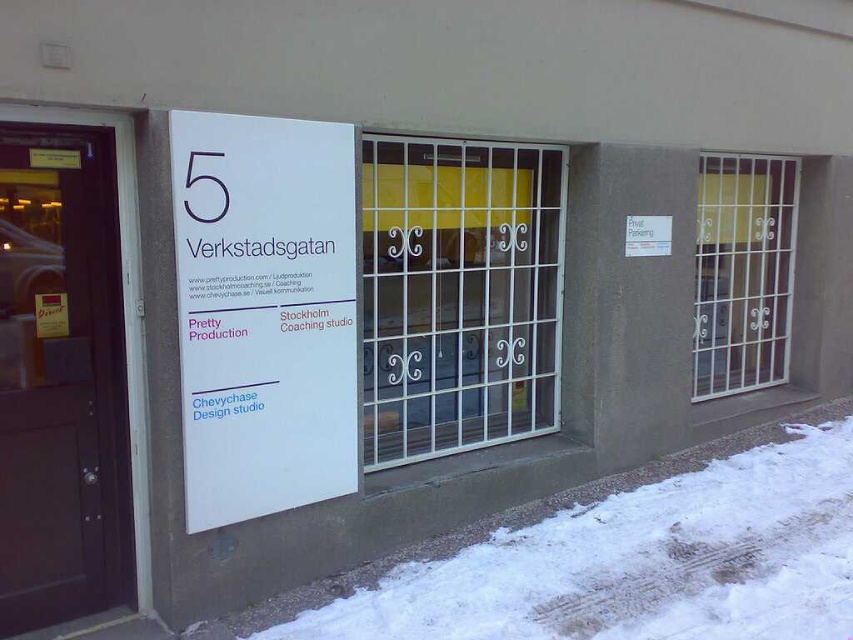
Which is below, white paper sign at center or brown wooden door at left?

Positioned lower is brown wooden door at left.

Between white paper sign at center and brown wooden door at left, which one has less height?

white paper sign at center

Locate an element on the screen. This screenshot has height=640, width=853. white paper sign at center is located at coordinates (264, 312).

Which of these two, white powdery snow at lower right or white metal gate at center, stands taller?

white metal gate at center

Who is higher up, white powdery snow at lower right or white metal gate at center?

Positioned higher is white metal gate at center.

Does point (782, 520) come in front of point (424, 298)?

Yes, it is.

At what (x,y) coordinates should I click in order to perform the action: click on white powdery snow at lower right. Please return your answer as a coordinate pair (x, y). Image resolution: width=853 pixels, height=640 pixels. Looking at the image, I should click on (641, 563).

Consider the image. Which is more to the left, white powdery snow at lower right or brown wooden door at left?

brown wooden door at left

Does white powdery snow at lower right have a lesser width compared to brown wooden door at left?

No.

Locate an element on the screen. The width and height of the screenshot is (853, 640). white powdery snow at lower right is located at coordinates (641, 563).